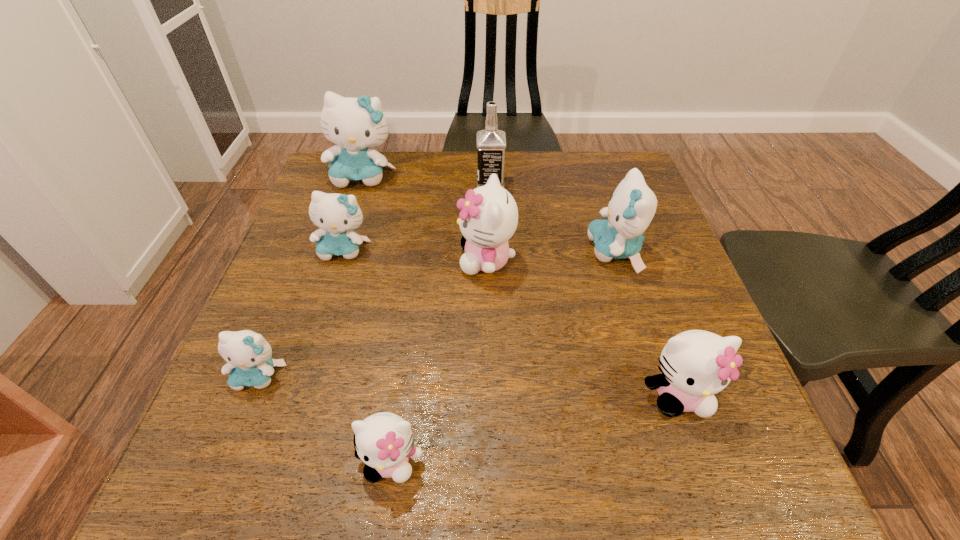
Where is `white kitten that is the second nearest to the rightmost blue kitten`? white kitten that is the second nearest to the rightmost blue kitten is located at coordinates (696, 364).

Where is `white kitten object that ranks as the closest to the smallest white kitten`? This screenshot has height=540, width=960. white kitten object that ranks as the closest to the smallest white kitten is located at coordinates (489, 215).

This screenshot has height=540, width=960. I want to click on blank area in the image that satisfies the following two spatial constraints: 1. on the front label of the vodka; 2. on the front-facing side of the smallest white kitten, so click(x=498, y=462).